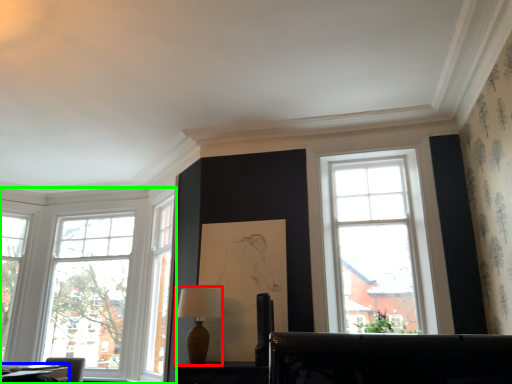
Question: Which object is positioned farthest from table lamp (highlighted by a red box)? Select from table (highlighted by a blue box) and window (highlighted by a green box).

Choices:
 (A) table
 (B) window

Answer: (B)